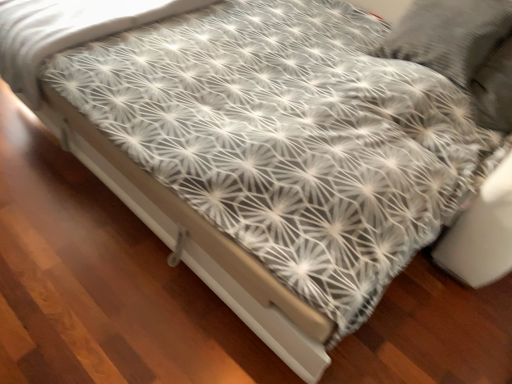
Question: Are white matte bed frame at center and white textured fabric at center far apart?

Choices:
 (A) no
 (B) yes

Answer: (A)

Question: Does white matte bed frame at center have a lesser height compared to white textured fabric at center?

Choices:
 (A) yes
 (B) no

Answer: (A)

Question: From a real-world perspective, is white matte bed frame at center located higher than white textured fabric at center?

Choices:
 (A) yes
 (B) no

Answer: (B)

Question: Considering the relative positions of white matte bed frame at center and white textured fabric at center in the image provided, is white matte bed frame at center in front of white textured fabric at center?

Choices:
 (A) yes
 (B) no

Answer: (A)

Question: Is white matte bed frame at center further to camera compared to white textured fabric at center?

Choices:
 (A) no
 (B) yes

Answer: (A)

Question: Considering the relative positions of white matte bed frame at center and white textured fabric at center in the image provided, is white matte bed frame at center to the right of white textured fabric at center from the viewer's perspective?

Choices:
 (A) no
 (B) yes

Answer: (B)

Question: Is white textured fabric at center bigger than white matte bed frame at center?

Choices:
 (A) yes
 (B) no

Answer: (A)

Question: From a real-world perspective, is white textured fabric at center on white matte bed frame at center?

Choices:
 (A) yes
 (B) no

Answer: (A)

Question: Does white textured fabric at center have a greater width compared to white matte bed frame at center?

Choices:
 (A) no
 (B) yes

Answer: (A)

Question: Is white textured fabric at center aimed at white matte bed frame at center?

Choices:
 (A) yes
 (B) no

Answer: (B)

Question: Does white textured fabric at center lie behind white matte bed frame at center?

Choices:
 (A) yes
 (B) no

Answer: (A)

Question: Does white textured fabric at center appear on the left side of white matte bed frame at center?

Choices:
 (A) no
 (B) yes

Answer: (B)

Question: From the image's perspective, is white matte bed frame at center above or below white textured fabric at center?

Choices:
 (A) below
 (B) above

Answer: (A)